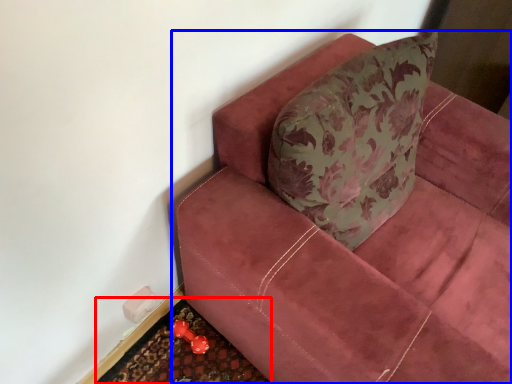
Question: Among these objects, which one is farthest to the camera, doormat (highlighted by a red box) or studio couch (highlighted by a blue box)?

Choices:
 (A) doormat
 (B) studio couch

Answer: (A)